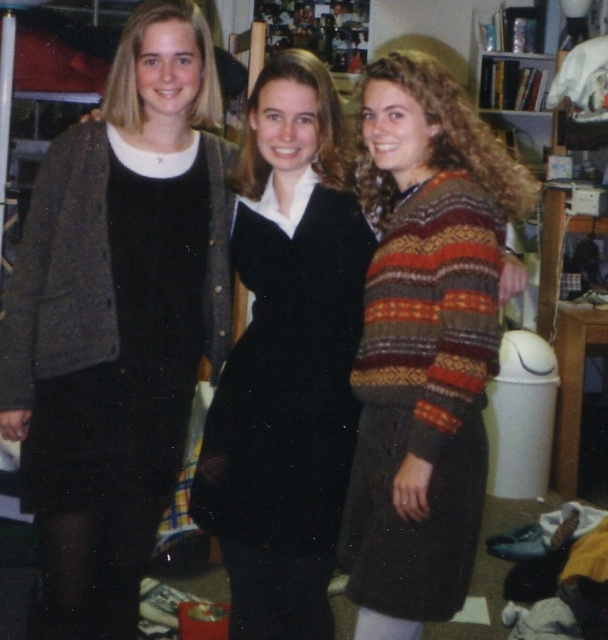
You are organizing a charity clothing drive and need to determine which items are suitable for adults versus children. Based on the sizes of the matte black dress at left and the knitted wool sweater at right, which item is more likely to belong to an adult?

The matte black dress at left is larger in size than the knitted wool sweater at right, so it is more likely to belong to an adult.

You are a photographer standing 3 feet away from the camera. You want to take a photo of the matte black dress at left. Can you reach the camera to take the photo without moving your feet?

The matte black dress at left and camera are 5.65 feet apart from each other. Since you are 3 feet away from the camera, the distance between you and the matte black dress at left would be 3 feet plus 5.65 feet, totaling 8.65 feet. However, to take a photo of the dress, you need to have the camera pointed towards it. Since the camera is already positioned 5.65 feet away from the dress, you can reach the camera to take the photo without moving your feet as long as you can adjust the camera angle or your arm.

You are organizing a charity event and need to hang the matte black dress at left and the black velvet dress at center on a rack. Since the rack has limited space, which dress should you place first to ensure both can fit properly?

The matte black dress at left should be placed first because it is in front of the black velvet dress at center, indicating it requires more space or is larger in size.